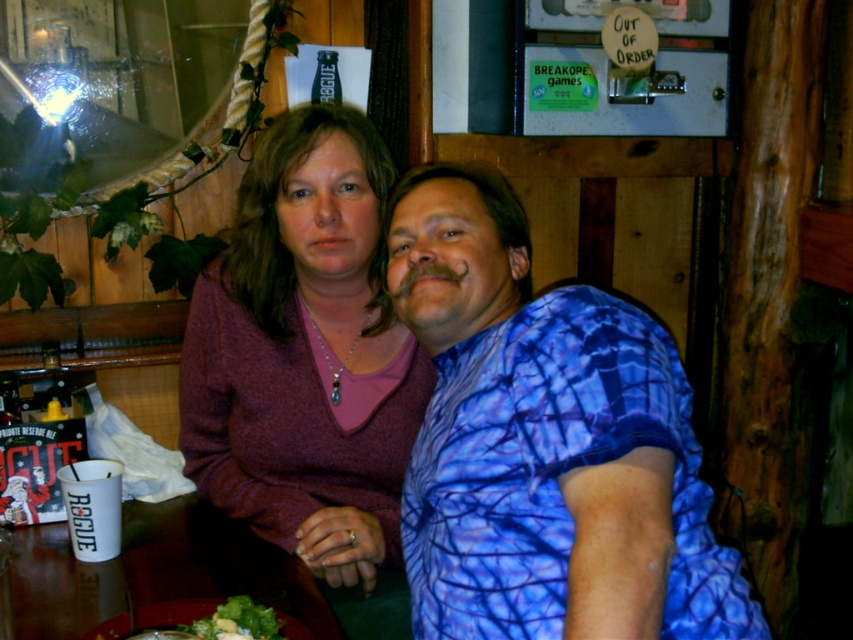
Between point (273, 564) and point (193, 604), which one is positioned in front?

Point (193, 604) is more forward.

This screenshot has height=640, width=853. I want to click on wooden table at lower center, so click(x=155, y=570).

Locate an element on the screen. wooden table at lower center is located at coordinates (155, 570).

Is matte purple sweater at center smaller than wooden table at lower center?

No, matte purple sweater at center is not smaller than wooden table at lower center.

Between point (230, 435) and point (201, 547), which one is positioned in front?

Point (201, 547) is in front.

You are a GUI agent. You are given a task and a screenshot of the screen. Output one action in this format:
    pyautogui.click(x=<x>, y=<y>)
    Task: Click on the matte purple sweater at center
    This screenshot has width=853, height=640.
    Given the screenshot: What is the action you would take?
    pyautogui.click(x=308, y=365)

What are the coordinates of `matte purple sweater at center` in the screenshot? It's located at (308, 365).

Who is positioned more to the left, blue tie-dye shirt at center or green leafy salad at lower center?

green leafy salad at lower center

Is blue tie-dye shirt at center to the left of green leafy salad at lower center from the viewer's perspective?

No, blue tie-dye shirt at center is not to the left of green leafy salad at lower center.

The image size is (853, 640). Describe the element at coordinates (544, 442) in the screenshot. I see `blue tie-dye shirt at center` at that location.

Locate an element on the screen. The height and width of the screenshot is (640, 853). blue tie-dye shirt at center is located at coordinates (544, 442).